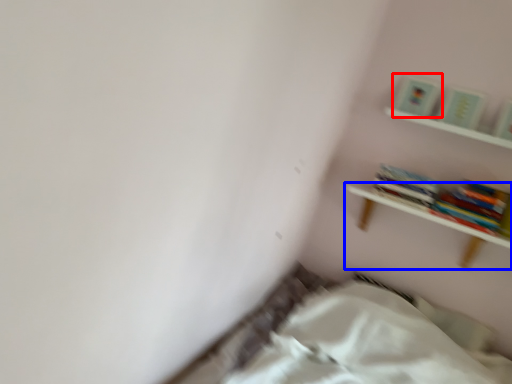
Question: Which of the following is the farthest to the observer, paperback book (highlighted by a red box) or shelf (highlighted by a blue box)?

Choices:
 (A) paperback book
 (B) shelf

Answer: (A)